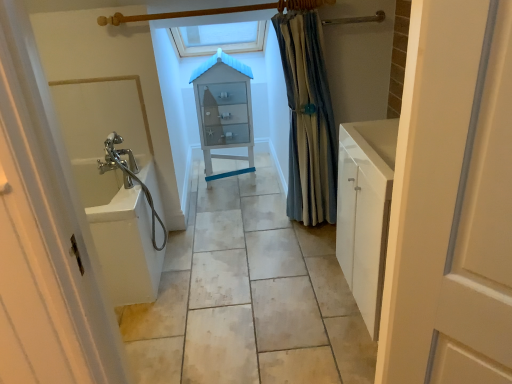
Where is `translucent glass cabinet at center`? translucent glass cabinet at center is located at coordinates (224, 110).

Image resolution: width=512 pixels, height=384 pixels. I want to click on white glossy bath at left, so click(x=121, y=234).

Image resolution: width=512 pixels, height=384 pixels. What do you see at coordinates (121, 234) in the screenshot?
I see `white glossy bath at left` at bounding box center [121, 234].

Locate an element on the screen. Image resolution: width=512 pixels, height=384 pixels. white glossy sink at left is located at coordinates (248, 296).

Is translucent glass cabinet at center shorter than white matte door at right?

Yes, translucent glass cabinet at center is shorter than white matte door at right.

Is point (229, 136) less distant than point (456, 234)?

No, it is not.

Which object is closer to the camera taking this photo, translucent glass cabinet at center or white matte door at right?

white matte door at right.

Between translucent glass cabinet at center and white matte door at right, which one has larger size?

translucent glass cabinet at center is bigger.

From the image's perspective, which is above, white matte door at right or translucent glass cabinet at center?

translucent glass cabinet at center.

Could you tell me if white matte door at right is turned towards translucent glass cabinet at center?

No, white matte door at right is not turned towards translucent glass cabinet at center.

Based on their positions, is white matte door at right located to the left or right of translucent glass cabinet at center?

In the image, white matte door at right appears on the right side of translucent glass cabinet at center.

Between white matte door at right and translucent glass cabinet at center, which one has more height?

white matte door at right is taller.

Measure the distance from white matte door at right to white glossy sink at left.

3.59 feet.

Are white matte door at right and white glossy sink at left located far from each other?

white matte door at right is positioned a significant distance from white glossy sink at left.

The image size is (512, 384). What are the coordinates of `path that is behind the white matte door at right` in the screenshot? It's located at (248, 296).

Which object is further away from the camera, translucent glass cabinet at center or white glossy bath at left?

translucent glass cabinet at center is further away from the camera.

In terms of height, does translucent glass cabinet at center look taller or shorter compared to white glossy bath at left?

translucent glass cabinet at center is taller than white glossy bath at left.

How many degrees apart are the facing directions of white glossy sink at left and translucent glass cabinet at center?

4.92 degrees separate the facing orientations of white glossy sink at left and translucent glass cabinet at center.

Does point (233, 193) lie behind point (242, 130)?

That is True.

Are white glossy sink at left and translucent glass cabinet at center located far from each other?

Yes.

From the picture: Is white glossy sink at left placed right next to white matte door at right?

white glossy sink at left is not next to white matte door at right, and they're not touching.

From a real-world perspective, is white glossy sink at left located higher than white matte door at right?

No, from a real-world perspective, white glossy sink at left is not over white matte door at right

Can you confirm if white glossy sink at left is smaller than white matte door at right?

No, white glossy sink at left is not smaller than white matte door at right.

Considering the sizes of objects white glossy sink at left and white matte door at right in the image provided, who is shorter, white glossy sink at left or white matte door at right?

white glossy sink at left is shorter.

Which point is more forward, (x=442, y=205) or (x=147, y=172)?

The point (x=442, y=205) is closer.

Could you tell me if white matte door at right is facing white glossy bath at left?

No.

From a real-world perspective, is white matte door at right positioned above or below white glossy bath at left?

From a real-world perspective, white matte door at right is physically above white glossy bath at left.

The image size is (512, 384). I want to click on door on the right of translucent glass cabinet at center, so click(452, 201).

Where is `medicine cabinet that appears above the white matte door at right (from the image's perspective)`? Image resolution: width=512 pixels, height=384 pixels. medicine cabinet that appears above the white matte door at right (from the image's perspective) is located at coordinates (224, 110).

Estimate the real-world distances between objects in this image. Which object is closer to blue striped fabric at right, white glossy bath at left or translucent glass cabinet at center?

translucent glass cabinet at center lies closer to blue striped fabric at right than the other object.

When comparing their distances from translucent glass cabinet at center, does white glossy sink at left or white matte door at right seem closer?

Based on the image, white glossy sink at left appears to be nearer to translucent glass cabinet at center.

Estimate the real-world distances between objects in this image. Which object is closer to blue striped fabric at right, translucent glass cabinet at center or white glossy sink at left?

white glossy sink at left is positioned closer to the anchor blue striped fabric at right.

When comparing their distances from white glossy sink at left, does white glossy bath at left or white matte door at right seem closer?

white glossy bath at left is closer to white glossy sink at left.

Considering their positions, is white glossy bath at left positioned closer to white matte door at right than blue striped fabric at right?

white glossy bath at left is closer to white matte door at right.

Which object lies further to the anchor point white glossy bath at left, white glossy sink at left or blue striped fabric at right?

blue striped fabric at right is positioned further to the anchor white glossy bath at left.

When comparing their distances from blue striped fabric at right, does white glossy sink at left or white glossy bath at left seem closer?

white glossy sink at left is positioned closer to the anchor blue striped fabric at right.

Estimate the real-world distances between objects in this image. Which object is further from white glossy bath at left, white glossy sink at left or white matte door at right?

Based on the image, white matte door at right appears to be further to white glossy bath at left.

Find the location of a particular element. This screenshot has height=384, width=512. shower curtain between white glossy sink at left and translucent glass cabinet at center in the front-back direction is located at coordinates click(x=308, y=120).

Find the location of a particular element. This screenshot has height=384, width=512. path located between white glossy bath at left and white matte door at right in the left-right direction is located at coordinates (248, 296).

Identify the location of bath positioned between white matte door at right and translucent glass cabinet at center from near to far. (121, 234).

Identify the location of path between white glossy bath at left and blue striped fabric at right in the horizontal direction. This screenshot has width=512, height=384. (248, 296).